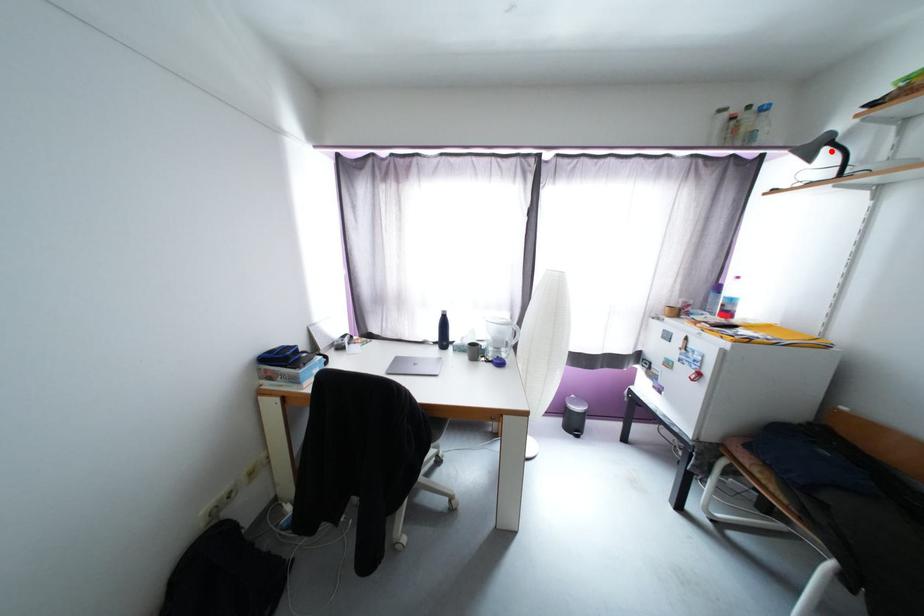
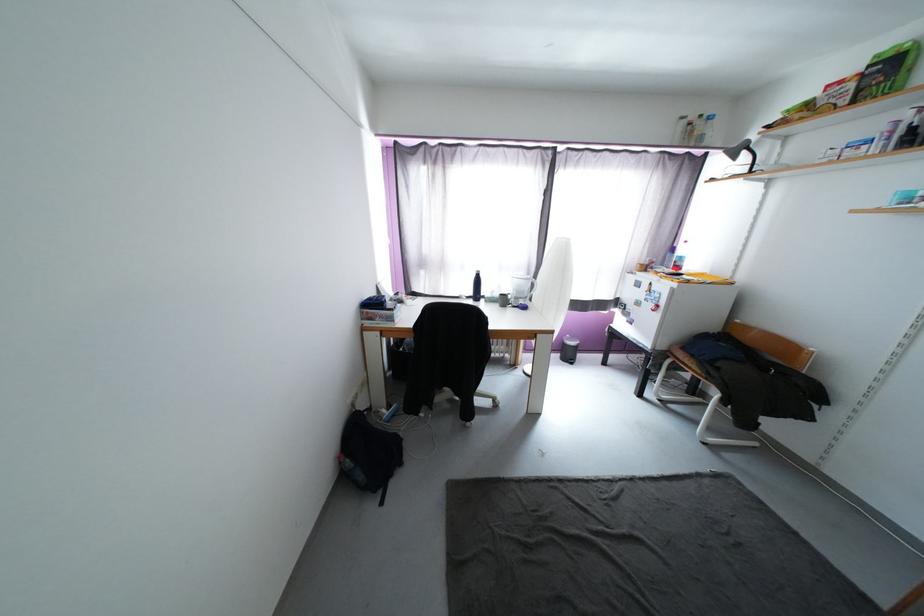
Find the pixel in the second image that matches the highlighted location in the first image.

(749, 154)